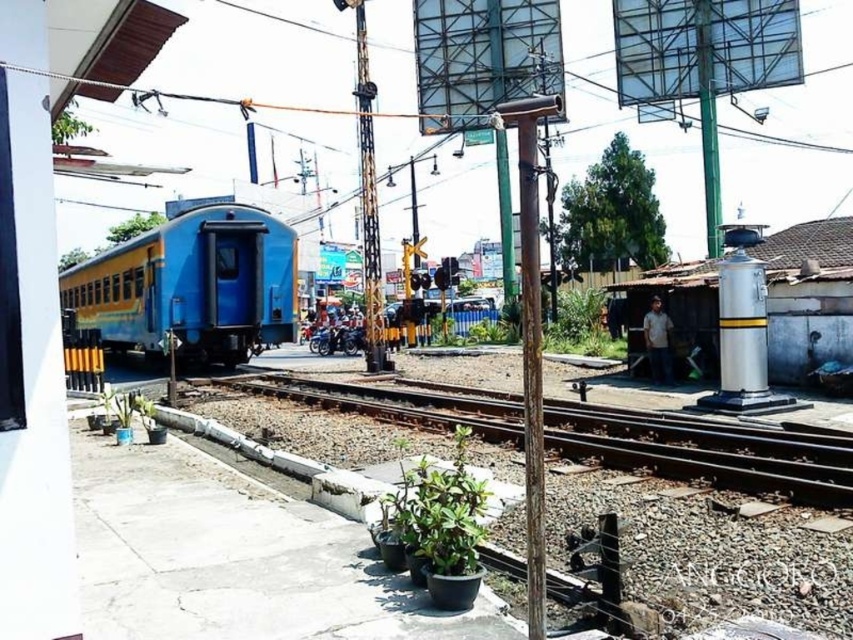
How distant is brown gravel train track at center from white shirt at right?

A distance of 4.82 meters exists between brown gravel train track at center and white shirt at right.

Is brown gravel train track at center smaller than white shirt at right?

Incorrect, brown gravel train track at center is not smaller in size than white shirt at right.

Who is more forward, (498, 420) or (651, 364)?

Positioned in front is point (498, 420).

Identify the location of brown gravel train track at center. The width and height of the screenshot is (853, 640). (706, 449).

Between point (97, 260) and point (374, 205), which one is positioned behind?

Positioned behind is point (97, 260).

Is blue matte train at left below metallic pole at center?

Yes.

The height and width of the screenshot is (640, 853). I want to click on blue matte train at left, so click(x=190, y=285).

Locate an element on the screen. blue matte train at left is located at coordinates (190, 285).

Does point (213, 273) come closer to viewer compared to point (659, 371)?

No, (213, 273) is further to viewer.

Is point (287, 305) farther from camera compared to point (659, 364)?

Yes.

Where is `blue matte train at left`? The height and width of the screenshot is (640, 853). blue matte train at left is located at coordinates (190, 285).